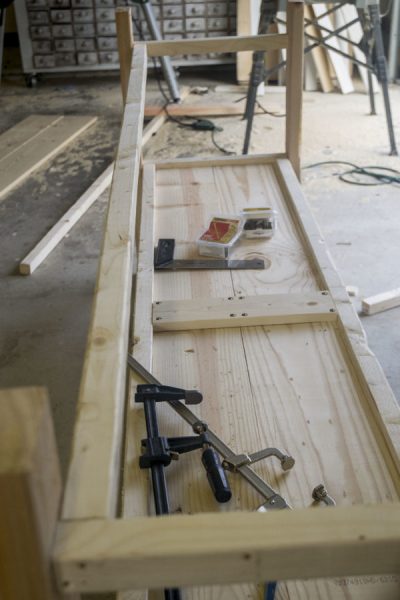
Find the location of a particular element. This screenshot has width=400, height=600. black cord is located at coordinates (181, 125), (220, 148), (322, 163), (372, 173).